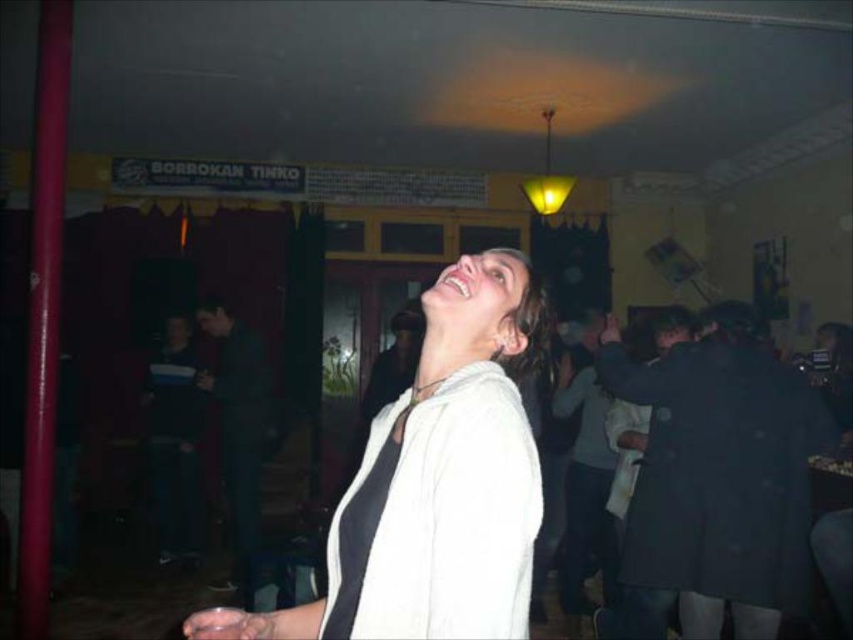
Question: Does white matte jacket at center have a larger size compared to white soft sweatshirt at center?

Choices:
 (A) yes
 (B) no

Answer: (A)

Question: Is black matte sweatshirt at right above white soft sweatshirt at center?

Choices:
 (A) yes
 (B) no

Answer: (B)

Question: Does black matte sweatshirt at right appear under white soft sweatshirt at center?

Choices:
 (A) no
 (B) yes

Answer: (B)

Question: Which point appears farthest from the camera in this image?

Choices:
 (A) (529, 545)
 (B) (737, 554)

Answer: (B)

Question: Which of these objects is positioned closest to the white soft sweatshirt at center?

Choices:
 (A) white matte jacket at center
 (B) black matte sweatshirt at right

Answer: (A)

Question: Which point is closer to the camera?

Choices:
 (A) (439, 420)
 (B) (790, 420)
 (C) (459, 595)

Answer: (C)